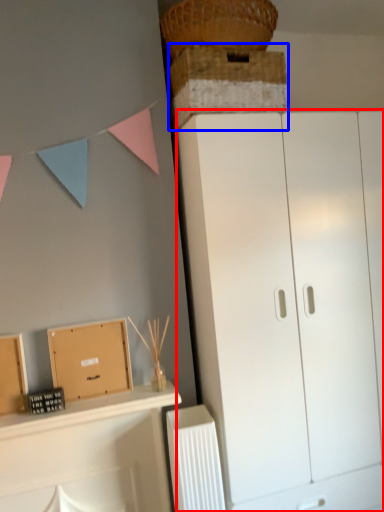
Question: Which object is further to the camera taking this photo, cupboard (highlighted by a red box) or cabinetry (highlighted by a blue box)?

Choices:
 (A) cupboard
 (B) cabinetry

Answer: (A)